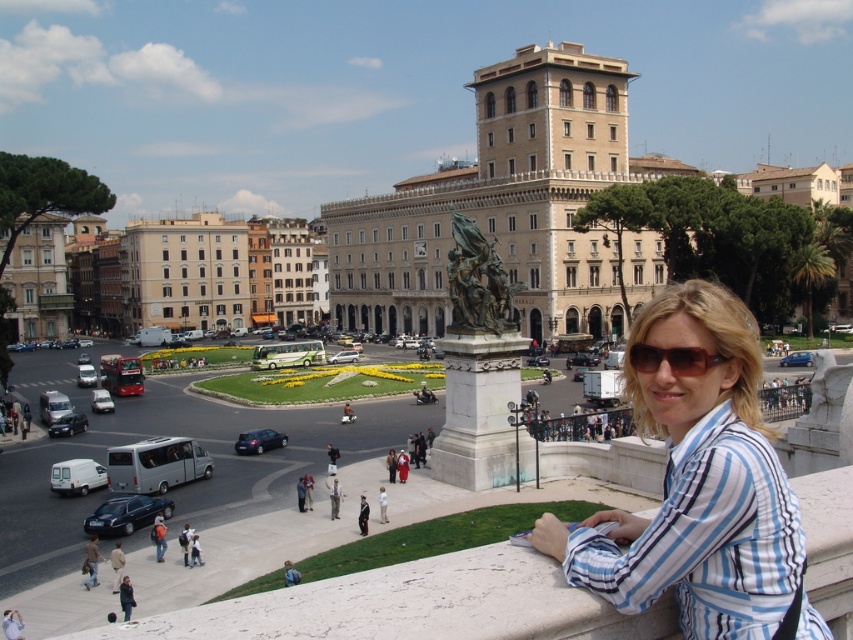
You are standing at the center of the city square and want to find the light brown leather jacket at lower center. Based on the coordinates provided, in which direction should you look to locate it?

The light brown leather jacket at lower center is located at coordinates point (x=334, y=497), which corresponds to the lower center area of the image. Since you are at the center of the city square, you should look towards the lower part of your field of view to locate it.